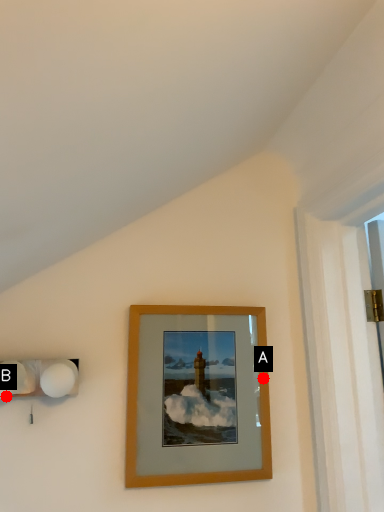
Question: Two points are circled on the image, labeled by A and B beside each circle. Among these points, which one is farthest from the camera?

Choices:
 (A) A is further
 (B) B is further

Answer: (A)